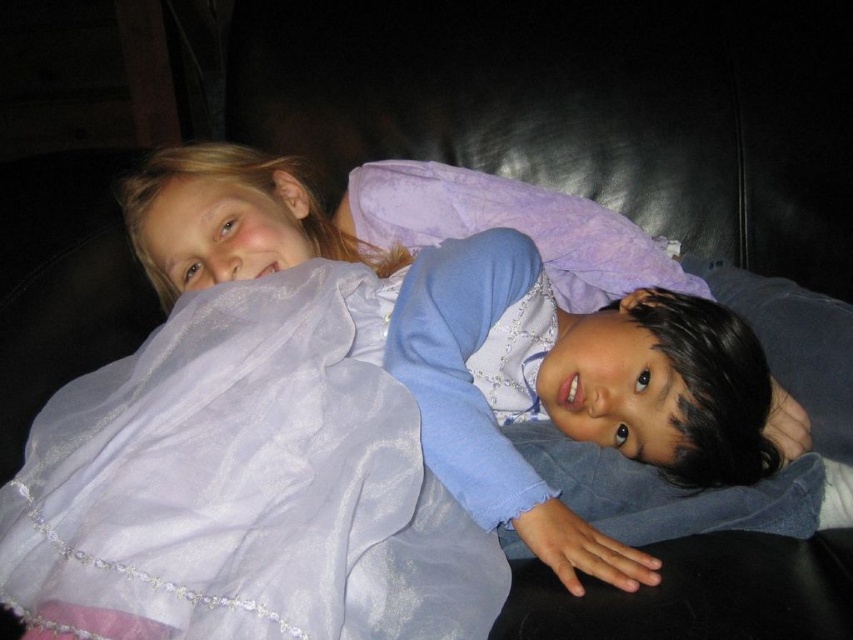
Question: Is matte purple dress at center to the right of translucent lavender fabric at center from the viewer's perspective?

Choices:
 (A) yes
 (B) no

Answer: (A)

Question: Does matte purple dress at center have a greater width compared to translucent lavender fabric at center?

Choices:
 (A) no
 (B) yes

Answer: (B)

Question: Which of the following is the farthest from the observer?

Choices:
 (A) (387, 492)
 (B) (228, 269)

Answer: (B)

Question: Does matte purple dress at center appear under translucent lavender fabric at center?

Choices:
 (A) no
 (B) yes

Answer: (A)

Question: Which object is closer to the camera taking this photo?

Choices:
 (A) matte purple dress at center
 (B) translucent lavender fabric at center

Answer: (B)